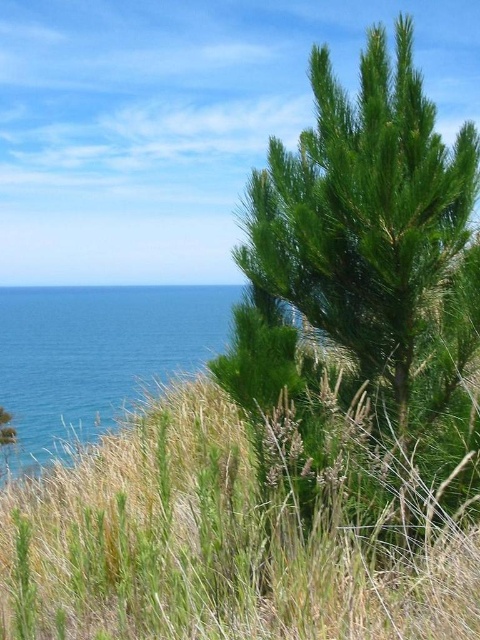
Question: Which point appears farthest from the camera in this image?

Choices:
 (A) (49, 451)
 (B) (362, 493)

Answer: (A)

Question: Is green grassy at center smaller than blue liquid water at left?

Choices:
 (A) no
 (B) yes

Answer: (B)

Question: Is green grassy at center positioned before blue liquid water at left?

Choices:
 (A) yes
 (B) no

Answer: (A)

Question: Which point is farther to the camera?

Choices:
 (A) green needle-like at center
 (B) blue liquid water at left
 (C) green grassy at center

Answer: (B)

Question: Is green needle-like at center below green grassy at center?

Choices:
 (A) no
 (B) yes

Answer: (A)

Question: Which object is positioned farthest from the green grassy at center?

Choices:
 (A) blue liquid water at left
 (B) green needle-like at center

Answer: (A)